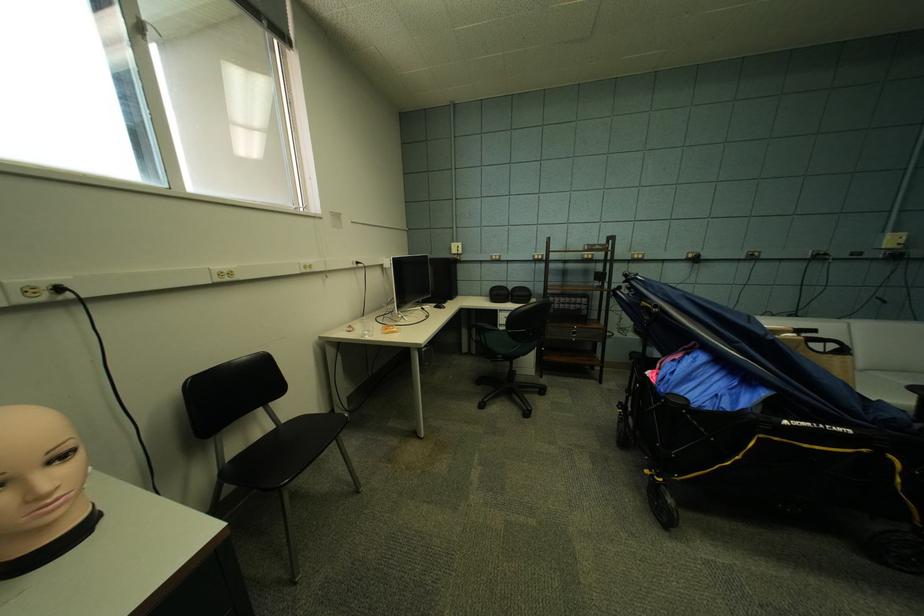
What do you see at coordinates (282, 453) in the screenshot? The image size is (924, 616). I see `the office chair sitting surface` at bounding box center [282, 453].